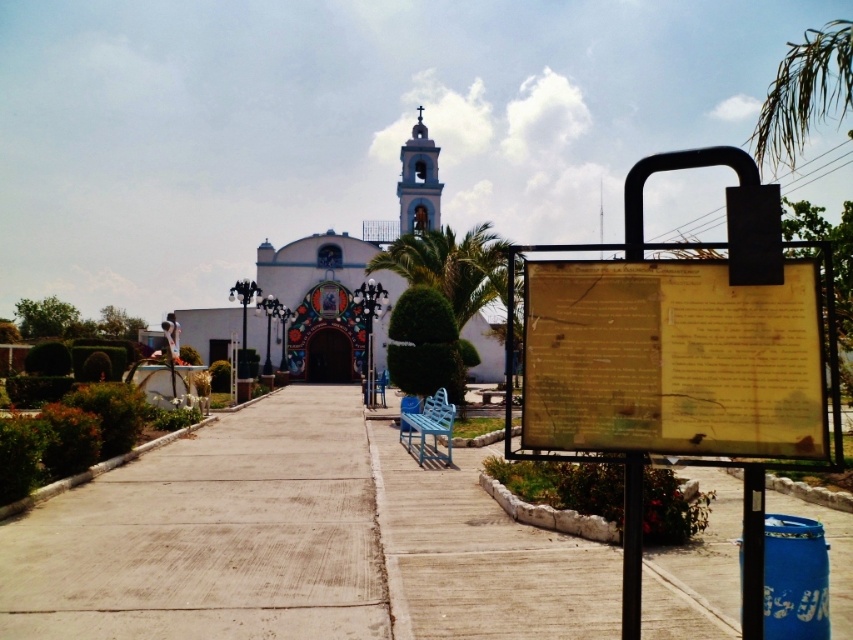
Is gray concrete pavement at center thinner than yellow paper sign at center?

No, gray concrete pavement at center is not thinner than yellow paper sign at center.

Which of these two, gray concrete pavement at center or yellow paper sign at center, stands taller?

With more height is yellow paper sign at center.

Where is `gray concrete pavement at center`? This screenshot has height=640, width=853. gray concrete pavement at center is located at coordinates (212, 536).

Between yellow paper sign at center and white matte church at center, which one has more height?

Standing taller between the two is white matte church at center.

From the picture: Which of these two, yellow paper sign at center or white matte church at center, stands shorter?

With less height is yellow paper sign at center.

Find the location of a particular element. yellow paper sign at center is located at coordinates [x=672, y=358].

Image resolution: width=853 pixels, height=640 pixels. I want to click on yellow paper sign at center, so click(672, 358).

Based on the photo, does yellow paper sign at center have a greater height compared to concrete at center?

Indeed, yellow paper sign at center has a greater height compared to concrete at center.

Does point (630, 349) come in front of point (561, 556)?

Yes, it is.

Where is `yellow paper sign at center`? This screenshot has width=853, height=640. yellow paper sign at center is located at coordinates (672, 358).